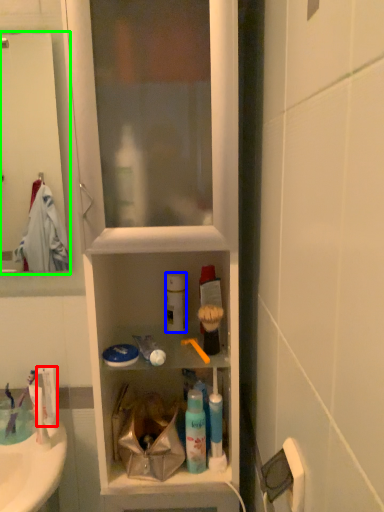
Question: Which is nearer to the toothpaste (highlighted by a red box)? cleaning product (highlighted by a blue box) or screen door (highlighted by a green box).

Choices:
 (A) cleaning product
 (B) screen door

Answer: (A)